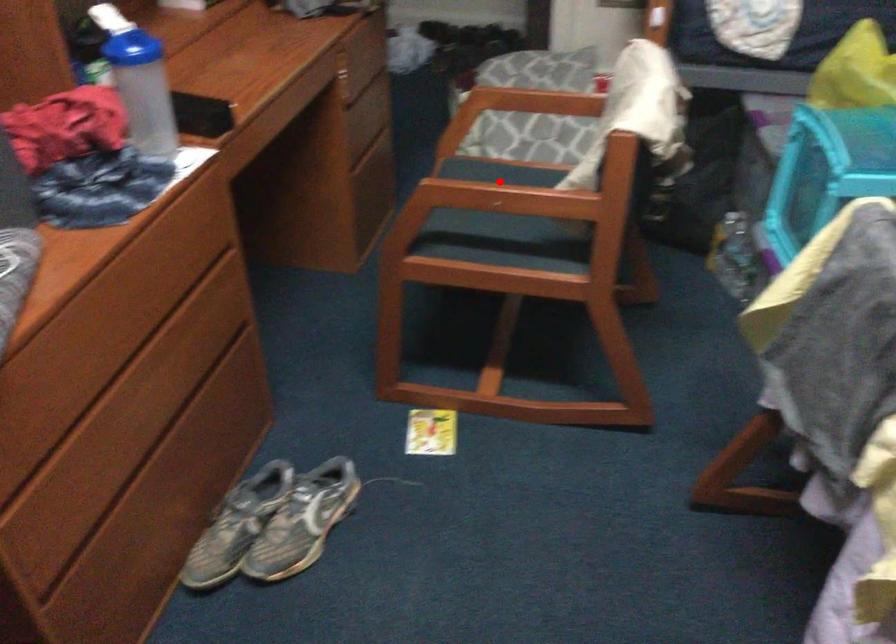
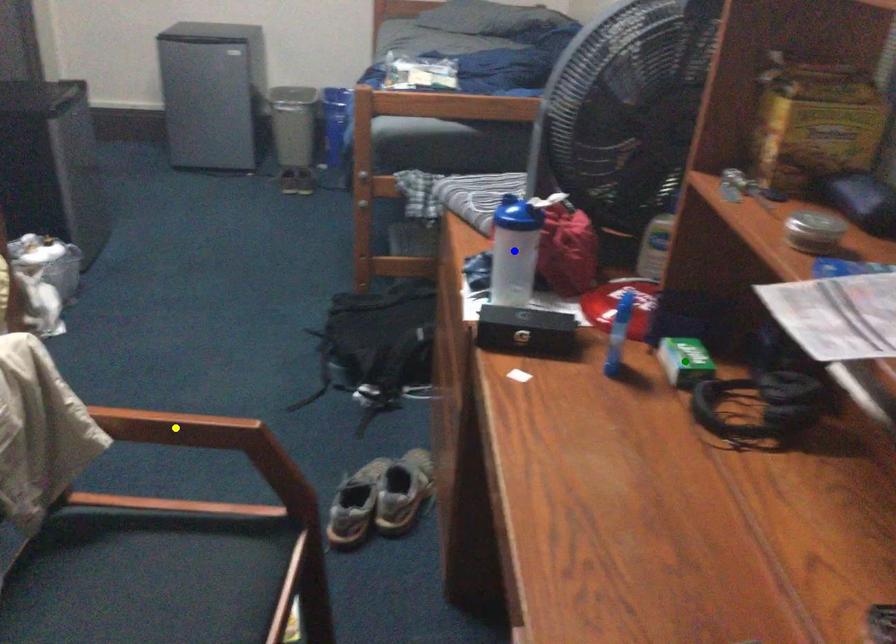
Question: I am providing you with two images of the same scene from different viewpoints. A red point is marked on the first image. You are given multiple points on the second image. Can you choose the point in image 2 that corresponds to the point in image 1?

Choices:
 (A) yellow point
 (B) green point
 (C) blue point

Answer: (A)